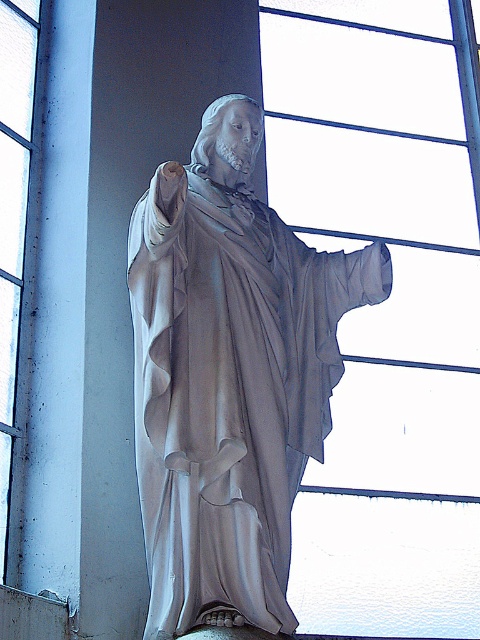
Question: Which is nearer to the transparent glass window at upper center?

Choices:
 (A) white marble statue at center
 (B) transparent glass window at upper left

Answer: (A)

Question: Can you confirm if transparent glass window at upper center is positioned above white marble statue at center?

Choices:
 (A) no
 (B) yes

Answer: (B)

Question: Which point is closer to the camera taking this photo?

Choices:
 (A) (428, 422)
 (B) (22, 81)
 (C) (134, 292)

Answer: (C)

Question: Can you confirm if white marble statue at center is positioned above transparent glass window at upper left?

Choices:
 (A) no
 (B) yes

Answer: (A)

Question: Does transparent glass window at upper center have a smaller size compared to transparent glass window at upper left?

Choices:
 (A) yes
 (B) no

Answer: (B)

Question: Which object is positioned closest to the transparent glass window at upper left?

Choices:
 (A) transparent glass window at upper center
 (B) white marble statue at center

Answer: (B)